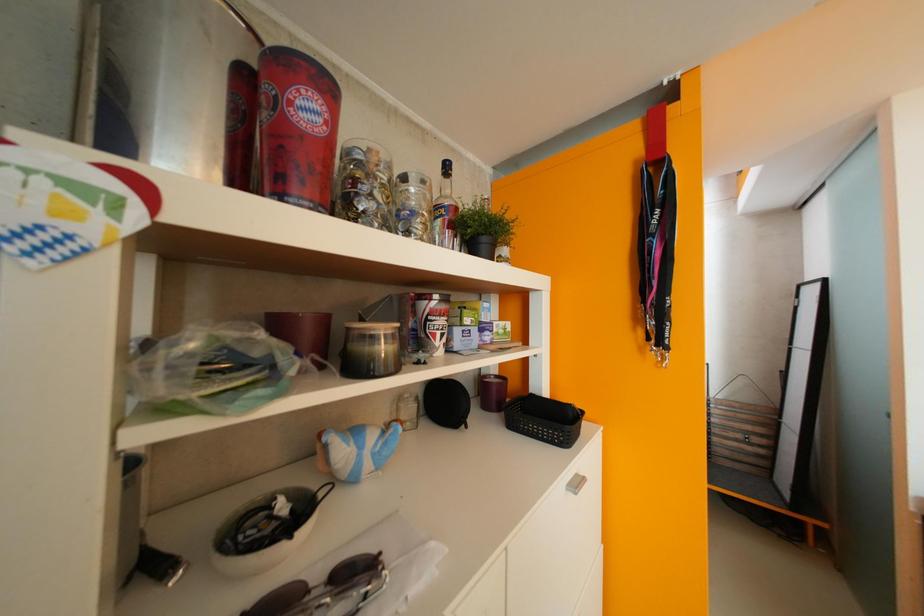
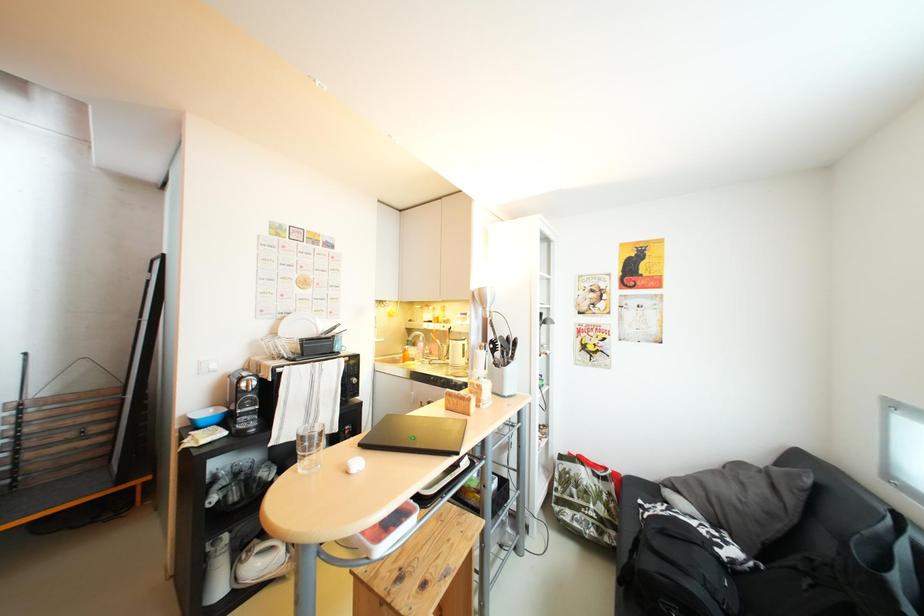
Question: The first image is from the beginning of the video and the second image is from the end. How did the camera likely rotate when shooting the video?

Choices:
 (A) Left
 (B) Right
 (C) Up
 (D) Down

Answer: (B)